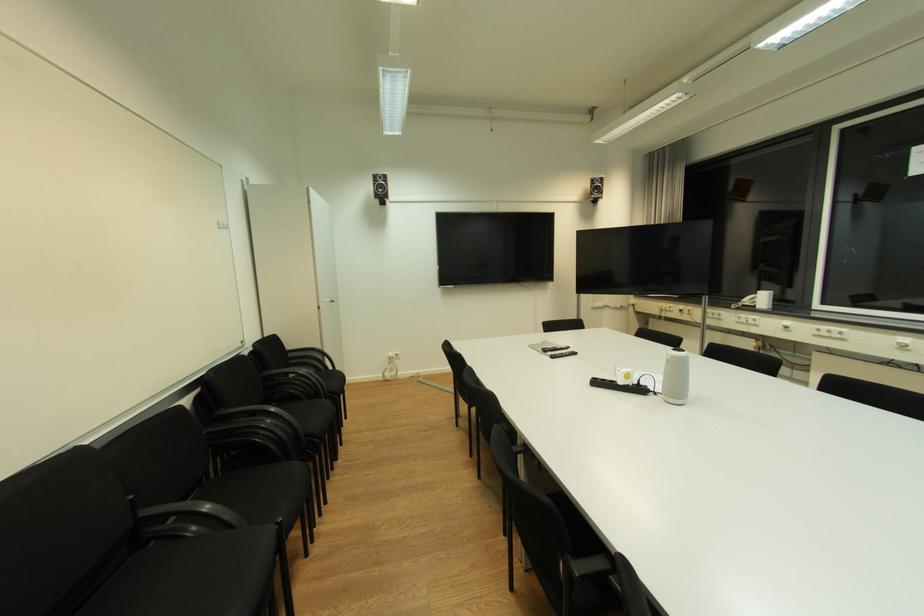
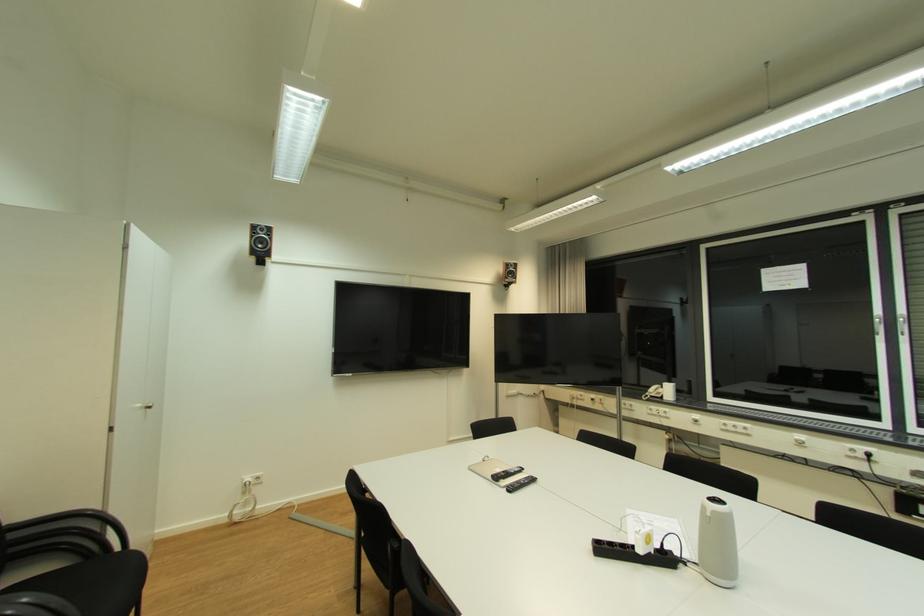
The point at (380, 177) is marked in the first image. Where is the corresponding point in the second image?

(261, 228)